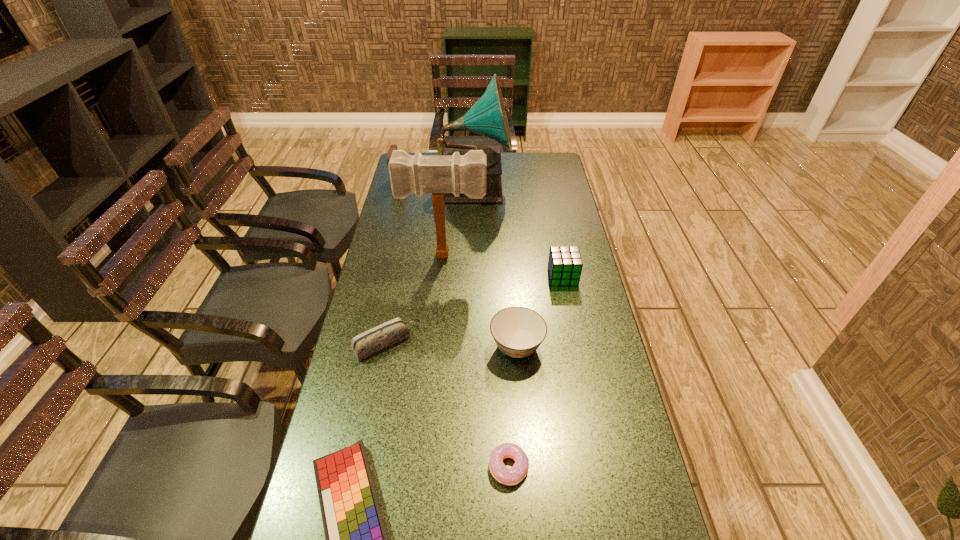
I want to click on record player, so click(487, 117).

At what (x,y) coordinates should I click in order to perform the action: click on mallet. Please return your answer as a coordinate pair (x, y). The height and width of the screenshot is (540, 960). Looking at the image, I should click on click(418, 174).

This screenshot has height=540, width=960. What are the coordinates of `the second tallest object` in the screenshot? It's located at (418, 174).

Identify the location of pouch. This screenshot has width=960, height=540. (393, 147).

Image resolution: width=960 pixels, height=540 pixels. I want to click on the fifth nearest object, so click(565, 264).

Find the location of `the rightmost object`. the rightmost object is located at coordinates (565, 264).

The image size is (960, 540). Identify the location of soup bowl. (518, 331).

This screenshot has height=540, width=960. Identify the location of pencil box. (382, 336).

You are a GUI agent. You are given a task and a screenshot of the screen. Output one action in this format:
    pyautogui.click(x=<x>, y=<y>)
    Task: Click on the doughnut
    This screenshot has height=540, width=960.
    Given the screenshot: What is the action you would take?
    pyautogui.click(x=511, y=476)

Identify the location of vacant space located on the horn of the tallest object. The width and height of the screenshot is (960, 540). (566, 185).